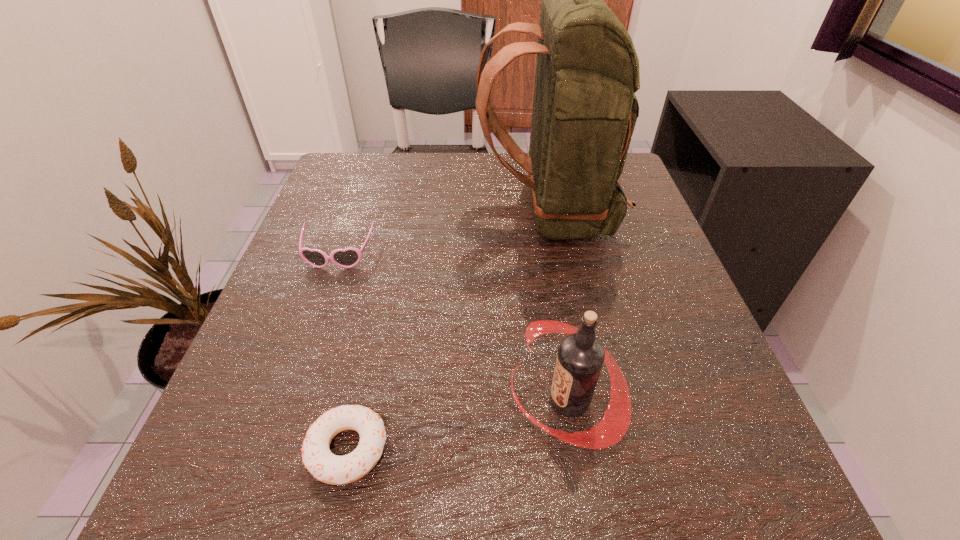
Locate an element on the screen. free space between the backpack and the sunglasses is located at coordinates (444, 234).

Locate an element on the screen. The height and width of the screenshot is (540, 960). vacant space that's between the tallest object and the root beer is located at coordinates (558, 307).

At what (x,y) coordinates should I click in order to perform the action: click on vacant space that is in between the second tallest object and the second shortest object. Please return your answer as a coordinate pair (x, y). Looking at the image, I should click on (453, 328).

Image resolution: width=960 pixels, height=540 pixels. I want to click on free space between the second tallest object and the doughnut, so 458,424.

This screenshot has width=960, height=540. What are the coordinates of `empty space between the second tallest object and the backpack` in the screenshot? It's located at (558, 307).

The width and height of the screenshot is (960, 540). Identify the location of free space between the second tallest object and the shortest object. pos(458,424).

You are a GUI agent. You are given a task and a screenshot of the screen. Output one action in this format:
    pyautogui.click(x=<x>, y=<y>)
    Task: Click on the free area in between the shortest object and the tallest object
    The height and width of the screenshot is (540, 960).
    Given the screenshot: What is the action you would take?
    pyautogui.click(x=447, y=330)

Identify which object is the second closest to the tallest object. Please provide its 2D coordinates. Your answer should be formatted as a tuple, i.e. [(x, y)], where the tuple contains the x and y coordinates of a point satisfying the conditions above.

[(580, 357)]

You are a GUI agent. You are given a task and a screenshot of the screen. Output one action in this format:
    pyautogui.click(x=<x>, y=<y>)
    Task: Click on the closest object relative to the backpack
    The width and height of the screenshot is (960, 540).
    Given the screenshot: What is the action you would take?
    pyautogui.click(x=347, y=258)

Find the location of a particular element. Image resolution: width=960 pixels, height=540 pixels. blank area in the image that satisfies the following two spatial constraints: 1. on the back of the backpack; 2. on the front-facing side of the second shortest object is located at coordinates tap(556, 255).